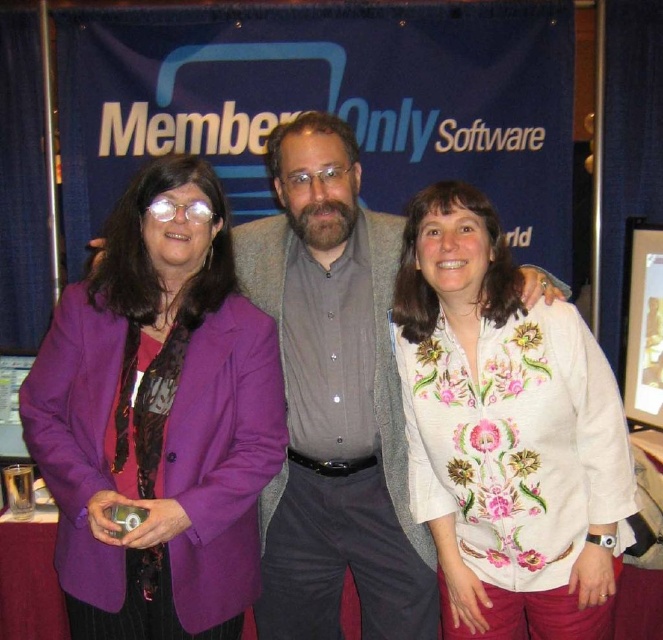
You are a photographer at the event and need to adjust the lighting between the white floral blouse at center and the gray textured sweater at center. How far apart are these two items?

The white floral blouse at center and the gray textured sweater at center are 25.08 centimeters apart from each other.

You are a photographer at the event and need to adjust the lighting to ensure both the purple fabric jacket at left and the gray textured sweater at center are well lit. Which object is positioned higher in the frame?

The purple fabric jacket at left is located above the gray textured sweater at center, so it is positioned higher in the frame.

In the scene shown: Based on the scene description, which object is shorter in height between the white floral blouse at center and the gray textured sweater at center?

The white floral blouse at center is shorter in height compared to the gray textured sweater at center.